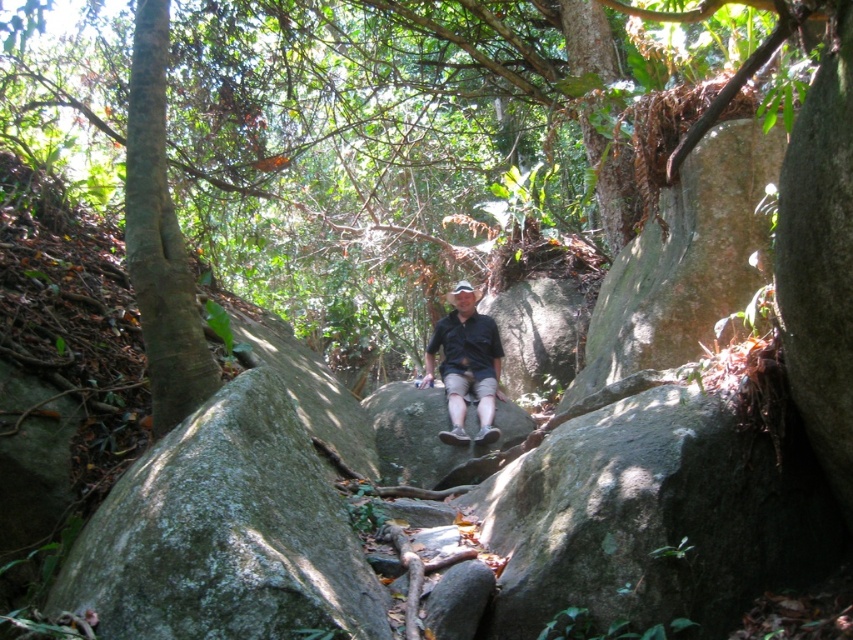
Can you confirm if gray rough rock at center is positioned to the left of matte black shirt at center?

Indeed, gray rough rock at center is positioned on the left side of matte black shirt at center.

Between gray rough rock at center and matte black shirt at center, which one has less height?

gray rough rock at center

You are a GUI agent. You are given a task and a screenshot of the screen. Output one action in this format:
    pyautogui.click(x=<x>, y=<y>)
    Task: Click on the gray rough rock at center
    
    Given the screenshot: What is the action you would take?
    pyautogui.click(x=430, y=435)

Find the location of a particular element. The image size is (853, 640). gray rough rock at center is located at coordinates (430, 435).

Is green leafy tree at center bigger than gray rough rock at center?

Indeed, green leafy tree at center has a larger size compared to gray rough rock at center.

Does green leafy tree at center have a lesser width compared to gray rough rock at center?

Incorrect, green leafy tree at center's width is not less than gray rough rock at center's.

This screenshot has width=853, height=640. I want to click on green leafy tree at center, so click(412, 115).

The width and height of the screenshot is (853, 640). I want to click on green leafy tree at center, so click(x=412, y=115).

Who is shorter, green leafy tree at center or matte black shirt at center?

matte black shirt at center

Is green leafy tree at center to the left of matte black shirt at center from the viewer's perspective?

Indeed, green leafy tree at center is positioned on the left side of matte black shirt at center.

Is point (236, 275) behind point (485, 356)?

Yes, it is behind point (485, 356).

Identify the location of green leafy tree at center. (412, 115).